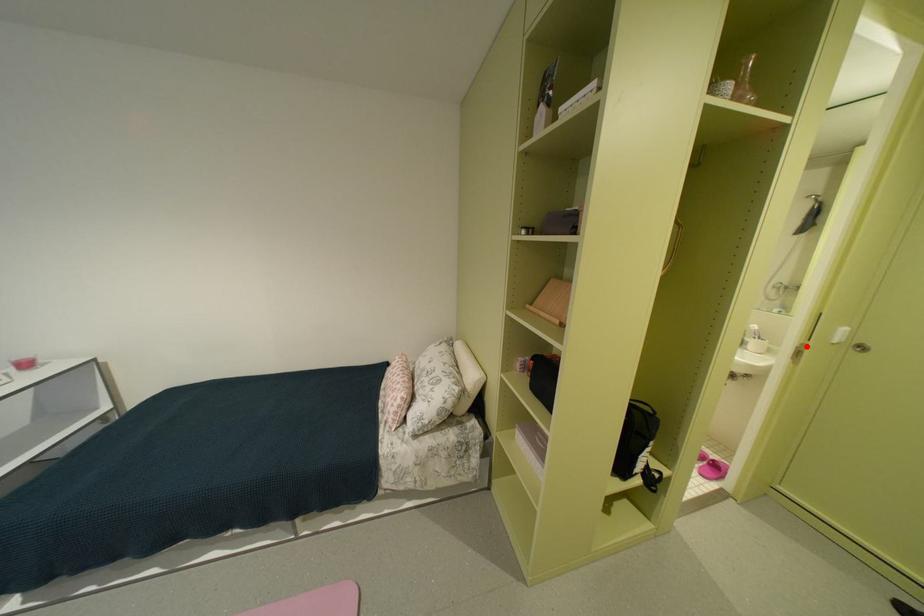
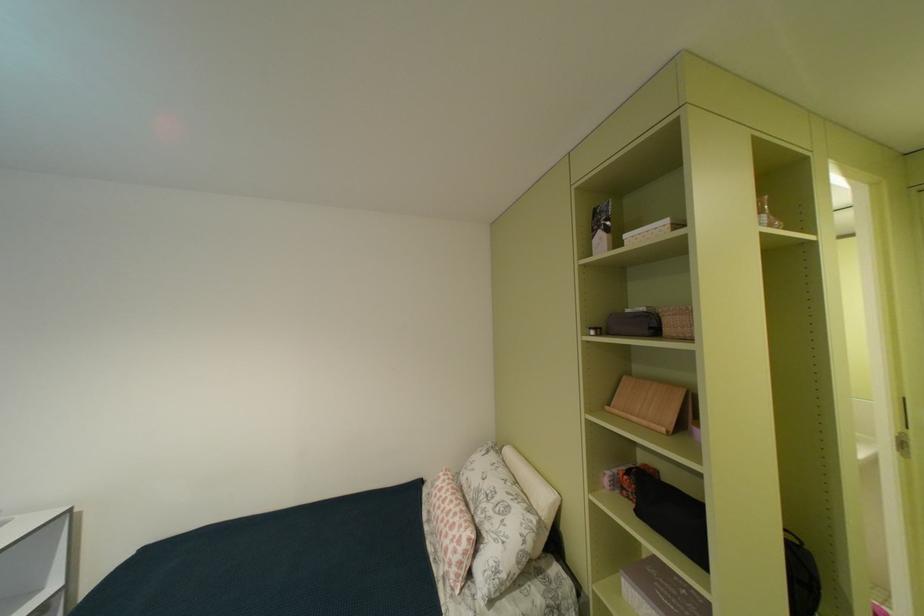
The point at the highlighted location is marked in the first image. Where is the corresponding point in the second image?

(905, 435)